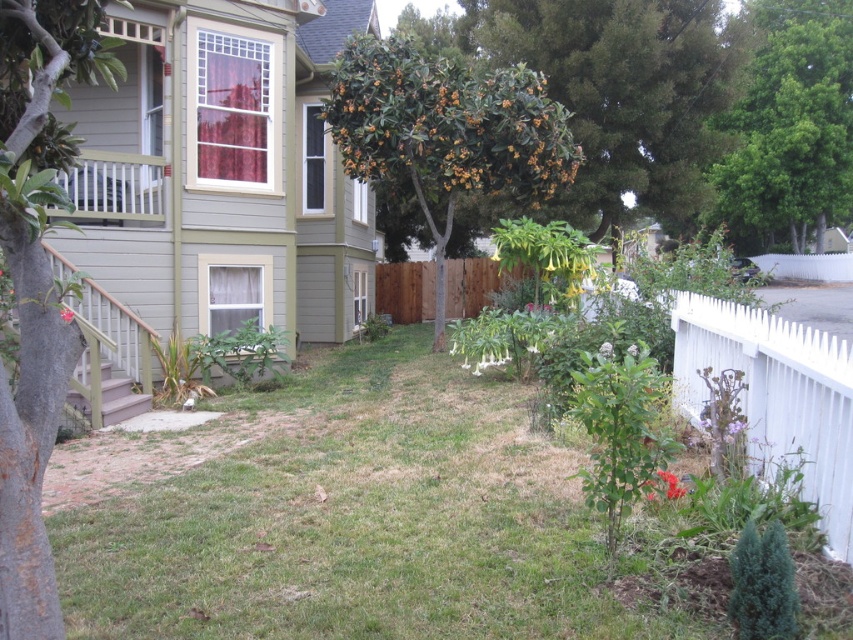
You are planning to install a new garden shed in the backyard. The shed requires a space that is wider than the green textured tree at left. Based on the scene, can you determine if the area near the green leafy tree at upper center is suitable for placing the shed?

The green leafy tree at upper center has a larger width than the green textured tree at left. Therefore, the area near the green leafy tree at upper center is suitable for placing the shed as it provides sufficient width required by the shed.

You are planning to install a new garden light in your backyard. The light requires a minimum of 1 meter of clearance above the tallest object it will be placed near. You have two options for placement near the green leafy tree at upper right and the white fuzzy flower at center. Which location would be suitable for the light based on their heights?

The green leafy tree at upper right is taller than the white fuzzy flower at center. Since the light requires 1 meter of clearance above the tallest object, you should choose the location near the white fuzzy flower at center to ensure sufficient clearance.

Consider the image. You are planning to plant a new tree in your backyard. You have two options from the image, the green leafy tree at upper center and the green textured tree at left. Which tree would require more space due to its size?

The green leafy tree at upper center is bigger than the green textured tree at left, so it would require more space due to its larger size.